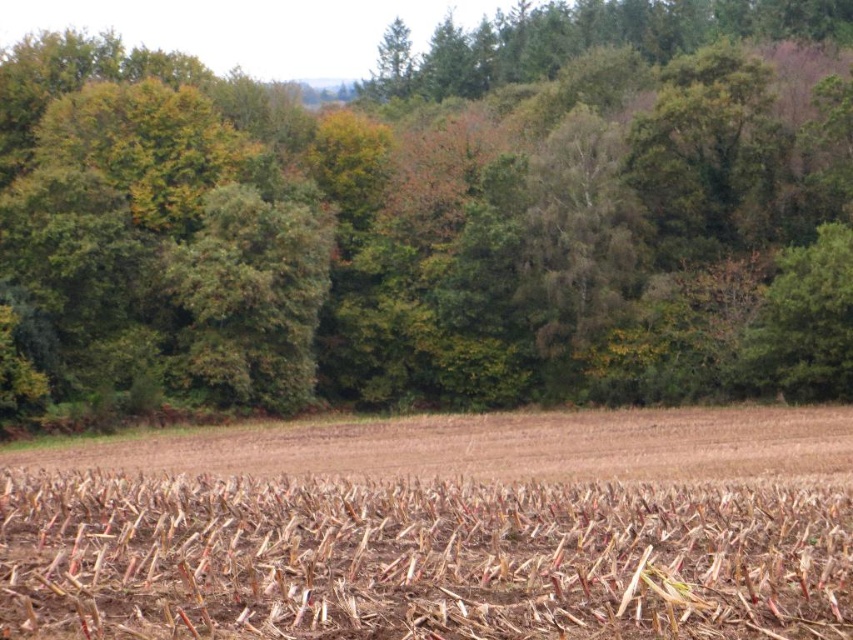
Who is positioned more to the right, green matte tree at center or brown dry stalks at center?

green matte tree at center is more to the right.

Is green matte tree at center wider than brown dry stalks at center?

Yes, green matte tree at center is wider than brown dry stalks at center.

Does point (97, 164) come behind point (788, 566)?

Yes.

Find the location of a particular element. This screenshot has height=640, width=853. green matte tree at center is located at coordinates (438, 216).